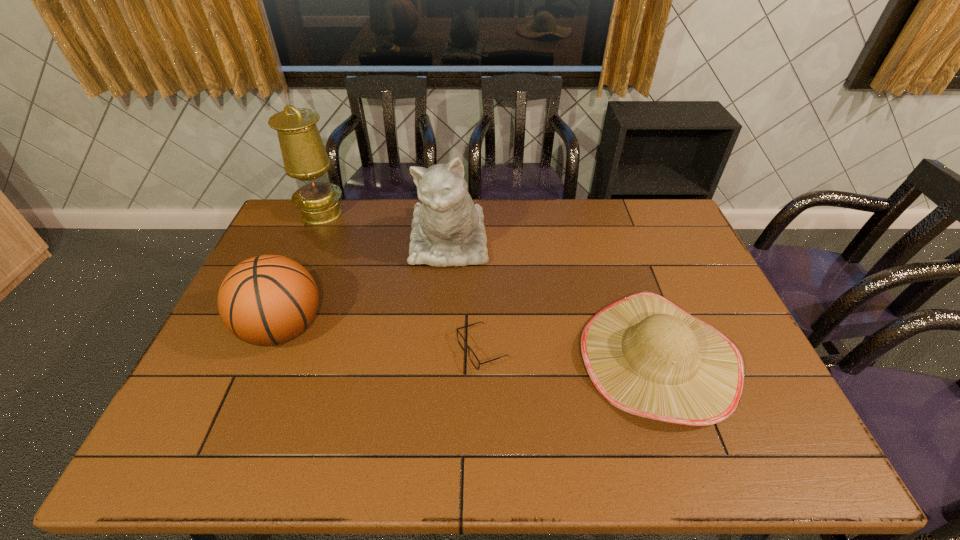
At what (x,y) coordinates should I click in order to perform the action: click on free space that satisfies the following two spatial constraints: 1. on the front-facing side of the cat; 2. on the right side of the rightmost object. Please return your answer as a coordinate pair (x, y). Image resolution: width=960 pixels, height=540 pixels. Looking at the image, I should click on (440, 359).

Find the location of a particular element. This screenshot has height=540, width=960. free location that satisfies the following two spatial constraints: 1. on the front-facing side of the rightmost object; 2. on the right side of the cat is located at coordinates (440, 359).